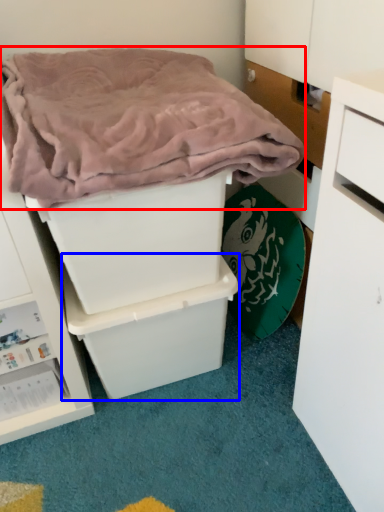
Question: Which point is further to the camera, blanket (highlighted by a red box) or storage box (highlighted by a blue box)?

Choices:
 (A) blanket
 (B) storage box

Answer: (B)